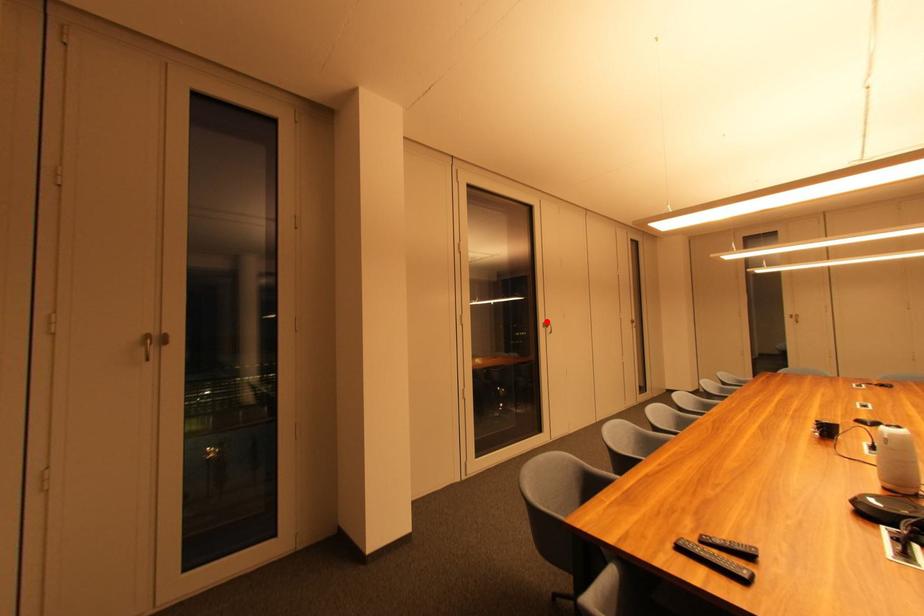
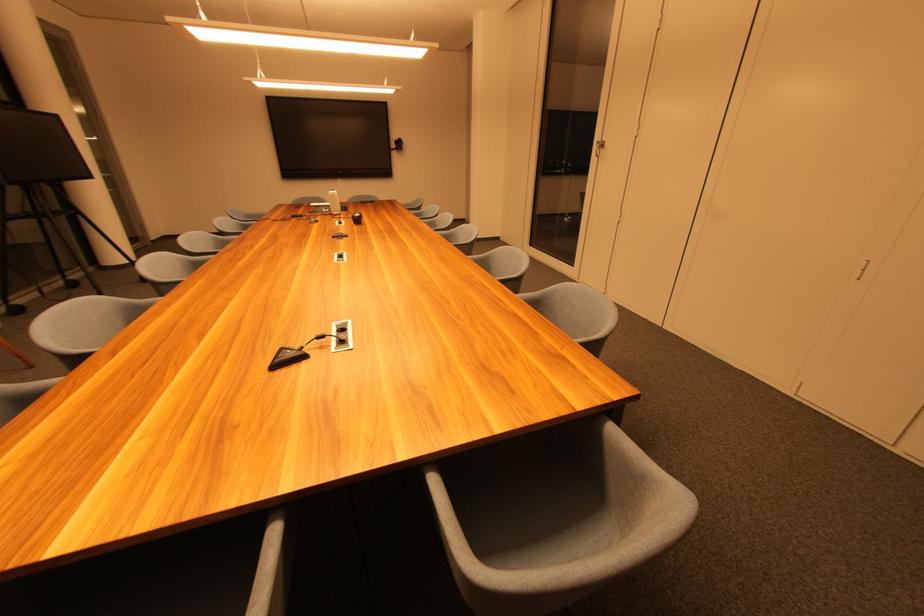
Question: I am providing you with two images of the same scene from different viewpoints. Given a red point in image1, look at the same physical point in image2. Is it:

Choices:
 (A) Closer to the viewpoint
 (B) Farther from the viewpoint

Answer: (A)